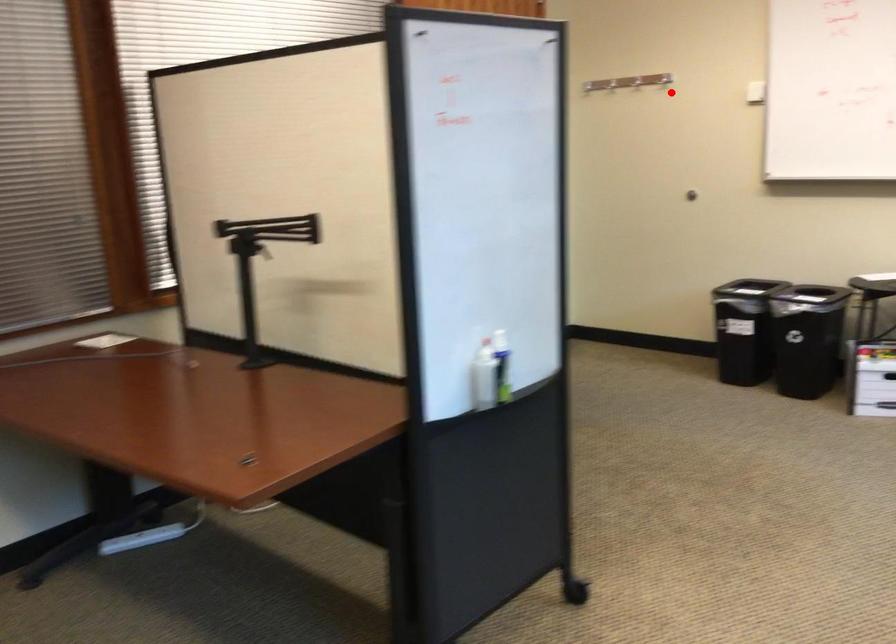
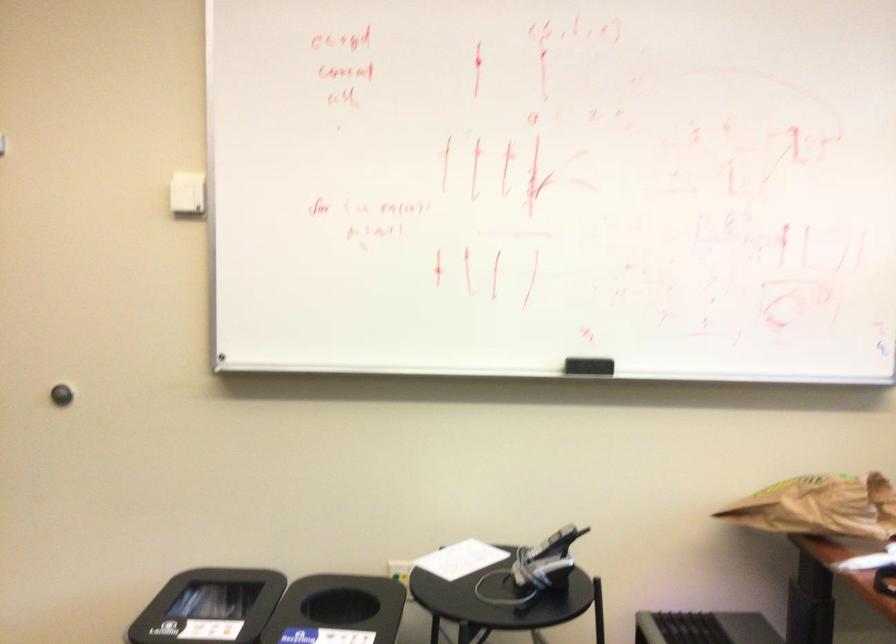
Where in the second image is the point corresponding to the highlighted location from the first image?

(186, 194)